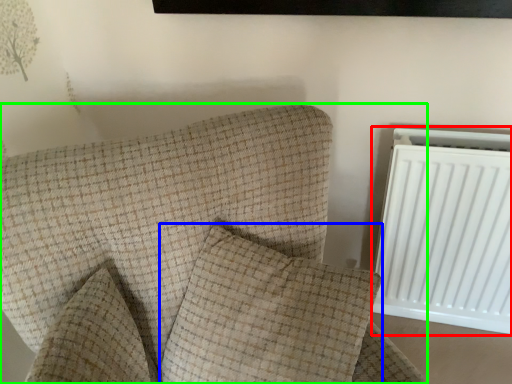
Question: Estimate the real-world distances between objects in this image. Which object is closer to radiator (highlighted by a red box), pillow (highlighted by a blue box) or furniture (highlighted by a green box)?

Choices:
 (A) pillow
 (B) furniture

Answer: (A)